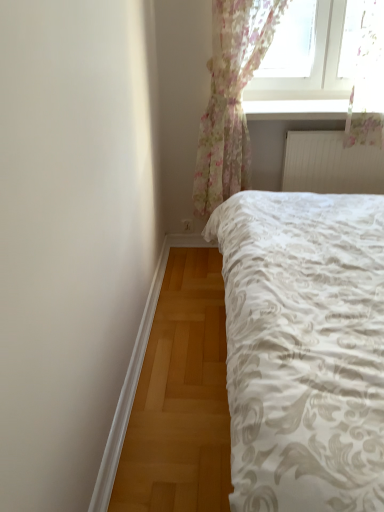
Question: From a real-world perspective, is white textured bed at center on floral sheer curtain at upper right?

Choices:
 (A) no
 (B) yes

Answer: (A)

Question: Considering the relative positions of white textured bed at center and floral sheer curtain at upper right in the image provided, is white textured bed at center to the left of floral sheer curtain at upper right from the viewer's perspective?

Choices:
 (A) yes
 (B) no

Answer: (B)

Question: Can you confirm if white textured bed at center is shorter than floral sheer curtain at upper right?

Choices:
 (A) no
 (B) yes

Answer: (B)

Question: Is white textured bed at center taller than floral sheer curtain at upper right?

Choices:
 (A) yes
 (B) no

Answer: (B)

Question: Is white textured bed at center in front of floral sheer curtain at upper right?

Choices:
 (A) no
 (B) yes

Answer: (B)

Question: From the image's perspective, is white textured radiator at upper right above or below floral sheer curtain at upper right?

Choices:
 (A) below
 (B) above

Answer: (A)

Question: Is white textured radiator at upper right taller or shorter than floral sheer curtain at upper right?

Choices:
 (A) short
 (B) tall

Answer: (A)

Question: In terms of width, does white textured radiator at upper right look wider or thinner when compared to floral sheer curtain at upper right?

Choices:
 (A) wide
 (B) thin

Answer: (B)

Question: Is white textured radiator at upper right bigger or smaller than floral sheer curtain at upper right?

Choices:
 (A) big
 (B) small

Answer: (B)

Question: From the image's perspective, is white textured bed at center located above or below floral sheer curtain at upper right?

Choices:
 (A) above
 (B) below

Answer: (B)

Question: Considering the positions of white textured bed at center and floral sheer curtain at upper right in the image, is white textured bed at center bigger or smaller than floral sheer curtain at upper right?

Choices:
 (A) small
 (B) big

Answer: (B)

Question: Is white textured bed at center inside the boundaries of floral sheer curtain at upper right, or outside?

Choices:
 (A) outside
 (B) inside

Answer: (A)

Question: In terms of width, does white textured bed at center look wider or thinner when compared to floral sheer curtain at upper right?

Choices:
 (A) wide
 (B) thin

Answer: (A)

Question: Considering their positions, is floral sheer curtain at upper right located in front of or behind white textured bed at center?

Choices:
 (A) front
 (B) behind

Answer: (B)

Question: From the image's perspective, is floral sheer curtain at upper right located above or below white textured bed at center?

Choices:
 (A) above
 (B) below

Answer: (A)